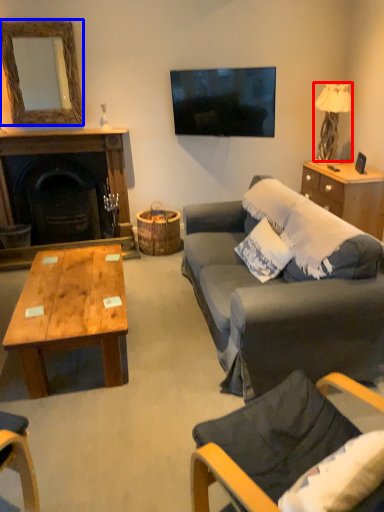
Question: Which point is further to the camera, lamp (highlighted by a red box) or mirror (highlighted by a blue box)?

Choices:
 (A) lamp
 (B) mirror

Answer: (A)